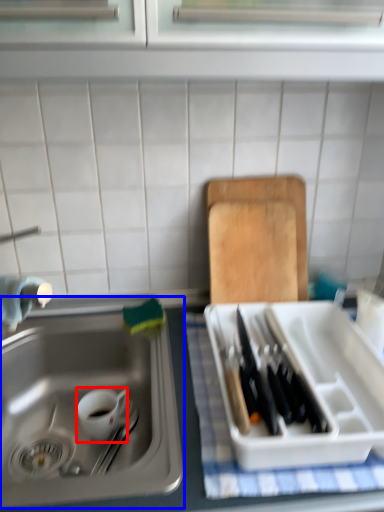
Question: Which point is closer to the camera, tableware (highlighted by a red box) or sink (highlighted by a blue box)?

Choices:
 (A) tableware
 (B) sink

Answer: (B)